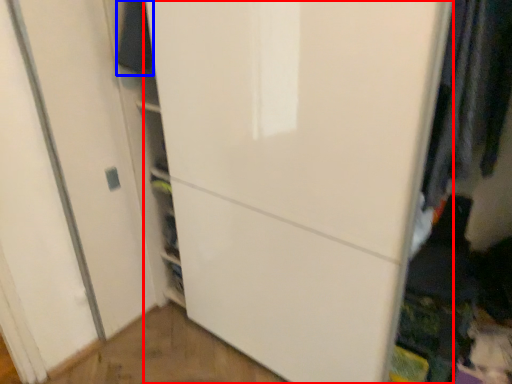
Question: Which object appears farthest to the camera in this image, door (highlighted by a red box) or clothing (highlighted by a blue box)?

Choices:
 (A) door
 (B) clothing

Answer: (B)